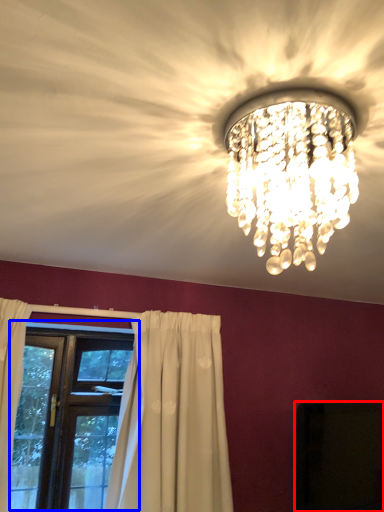
Question: Which of the following is the closest to the observer, dark (highlighted by a red box) or window (highlighted by a blue box)?

Choices:
 (A) dark
 (B) window

Answer: (A)